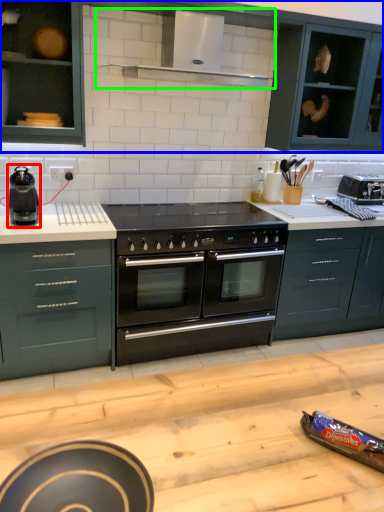
Question: Which object is the farthest from kitchen appliance (highlighted by a red box)? Choose among these: cabinetry (highlighted by a blue box) or exhaust hood (highlighted by a green box).

Choices:
 (A) cabinetry
 (B) exhaust hood

Answer: (B)